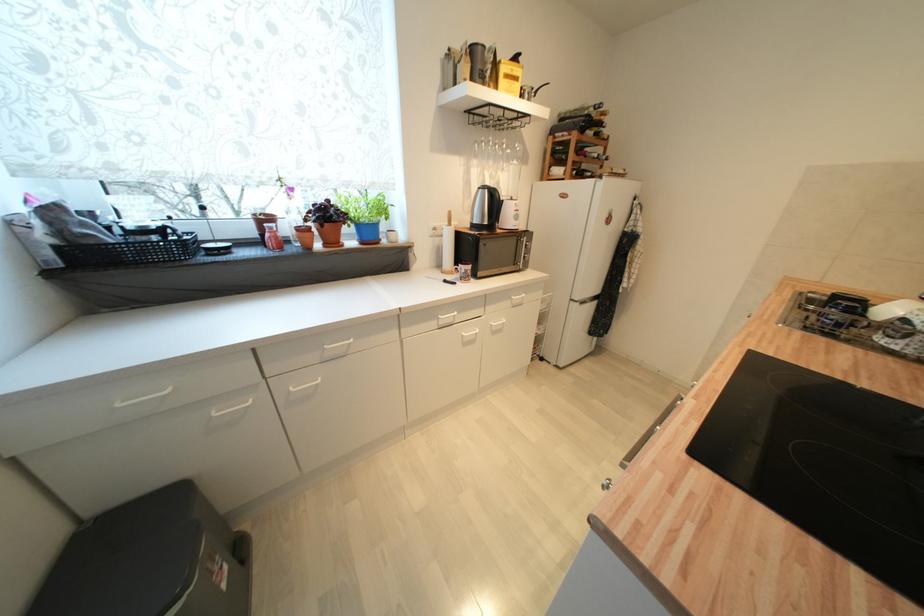
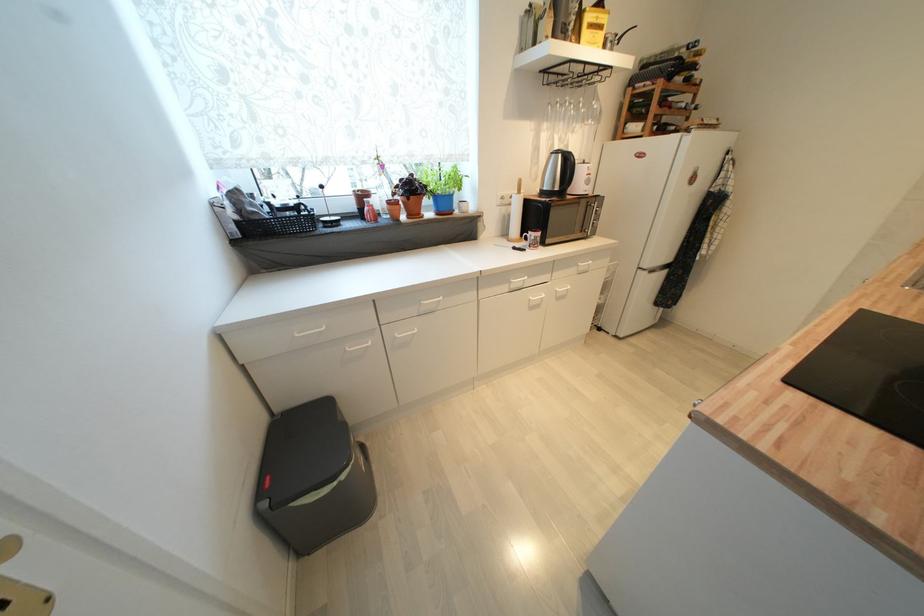
Find the pixel in the second image that matches point 468,273 in the first image.

(538, 240)